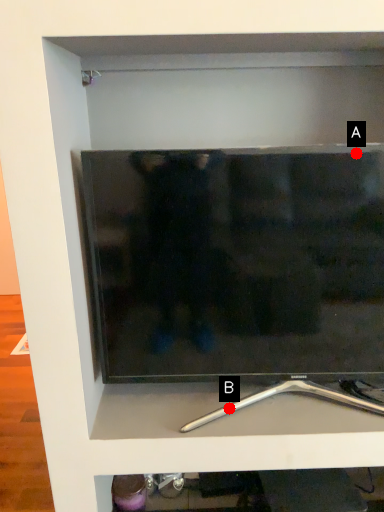
Question: Two points are circled on the image, labeled by A and B beside each circle. Which of the following is the closest to the observer?

Choices:
 (A) A is closer
 (B) B is closer

Answer: (A)